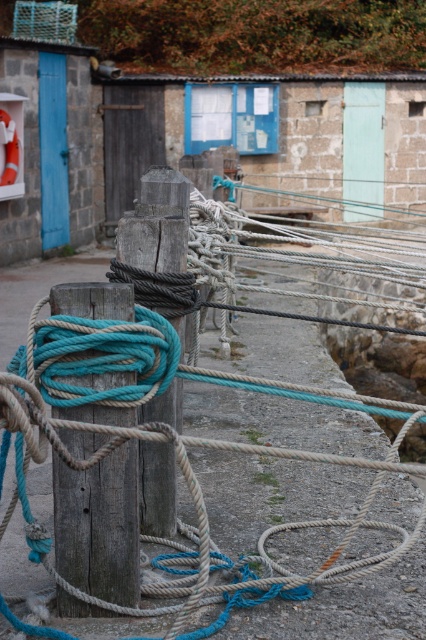
Looking at this image, you are standing on the dock and looking at two points marked on the image. Which point, point (52, 486) or point (149, 410), is closer to you?

Point (52, 486) is closer to you than point (149, 410).

You are standing on the dock and notice the teal rope at center and the weathered wood post at center. Which object is located lower in position?

The teal rope at center is below the weathered wood post at center, so the teal rope at center is lower in position.